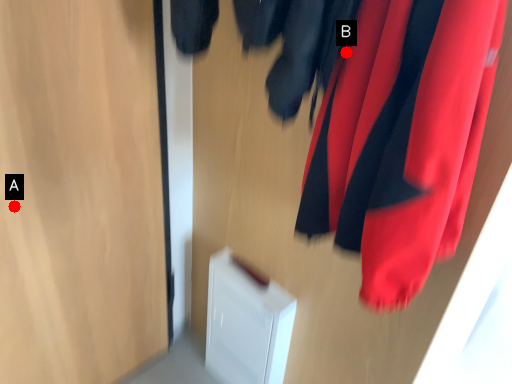
Question: Two points are circled on the image, labeled by A and B beside each circle. Among these points, which one is farthest from the camera?

Choices:
 (A) A is further
 (B) B is further

Answer: (A)